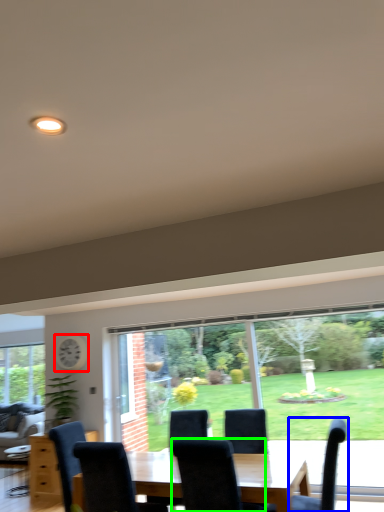
Question: Which is nearer to the clock (highlighted by a red box)? chair (highlighted by a blue box) or chair (highlighted by a green box).

Choices:
 (A) chair
 (B) chair

Answer: (B)